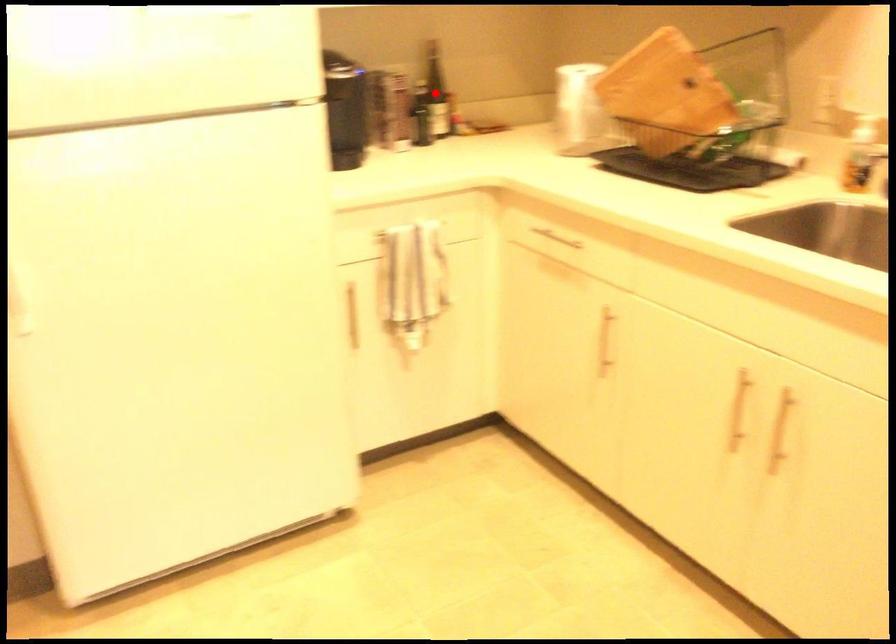
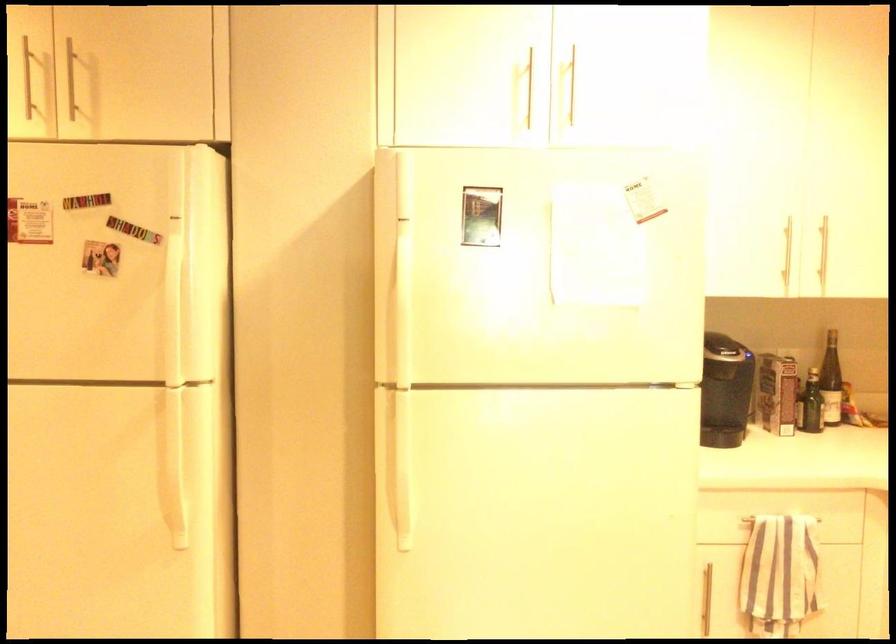
Find the pixel in the second image that matches the highlighted location in the first image.

(831, 381)